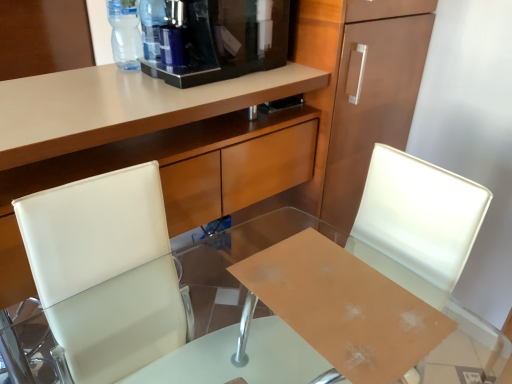
This screenshot has width=512, height=384. Describe the element at coordinates (264, 131) in the screenshot. I see `matte wood cabinet at upper center` at that location.

The width and height of the screenshot is (512, 384). Find the location of `white leather swivel chair at center`. white leather swivel chair at center is located at coordinates pos(105,271).

Describe the element at coordinates (152, 26) in the screenshot. This screenshot has width=512, height=384. I see `transparent plastic bottle at upper center, positioned as the second bottle in left-to-right order` at that location.

Find the location of `matte wood cabinet at upper center`. matte wood cabinet at upper center is located at coordinates (264, 131).

Is point (387, 212) closer or farther from the camera than point (312, 9)?

Point (387, 212) is closer to the camera than point (312, 9).

Based on the photo, which object is closer to the camera taking this photo, white leather chair at center or matte wood cabinet at upper center?

white leather chair at center.

Can you tell me how much white leather chair at center and matte wood cabinet at upper center differ in facing direction?

They differ by 90 degrees in their facing directions.

Is white leather chair at center bigger than matte wood cabinet at upper center?

Actually, white leather chair at center might be smaller than matte wood cabinet at upper center.

Based on their sizes in the image, would you say matte wood cabinet at upper center is bigger or smaller than transparent plastic bottle at upper center, marked as the second bottle in a right-to-left arrangement?

matte wood cabinet at upper center is bigger than transparent plastic bottle at upper center, marked as the second bottle in a right-to-left arrangement.

Is matte wood cabinet at upper center not within transparent plastic bottle at upper center, the first bottle viewed from the left?

Absolutely, matte wood cabinet at upper center is external to transparent plastic bottle at upper center, the first bottle viewed from the left.

Would you consider matte wood cabinet at upper center to be distant from transparent plastic bottle at upper center, marked as the second bottle in a right-to-left arrangement?

No, matte wood cabinet at upper center is in close proximity to transparent plastic bottle at upper center, marked as the second bottle in a right-to-left arrangement.

Which object is positioned more to the left, matte wood cabinet at upper center or transparent plastic bottle at upper center, marked as the second bottle in a right-to-left arrangement?

Positioned to the left is transparent plastic bottle at upper center, marked as the second bottle in a right-to-left arrangement.

Is the position of transparent plastic bottle at upper center, the first bottle viewed from the left, less distant than that of transparent plastic bottle at upper center, placed as the 1th bottle when sorted from right to left?

Yes, it is.

Looking at this image, is transparent plastic bottle at upper center, the first bottle viewed from the left, positioned with its back to transparent plastic bottle at upper center, placed as the 1th bottle when sorted from right to left?

Yes, transparent plastic bottle at upper center, the first bottle viewed from the left, is positioned with its back facing transparent plastic bottle at upper center, placed as the 1th bottle when sorted from right to left.

From a real-world perspective, is transparent plastic bottle at upper center, marked as the second bottle in a right-to-left arrangement, on transparent plastic bottle at upper center, positioned as the second bottle in left-to-right order?

No, from a real-world perspective, transparent plastic bottle at upper center, marked as the second bottle in a right-to-left arrangement, is not above transparent plastic bottle at upper center, positioned as the second bottle in left-to-right order.

What's the angular difference between transparent plastic bottle at upper center, the first bottle viewed from the left, and transparent plastic bottle at upper center, positioned as the second bottle in left-to-right order,'s facing directions?

transparent plastic bottle at upper center, the first bottle viewed from the left, and transparent plastic bottle at upper center, positioned as the second bottle in left-to-right order, are facing 4.75e-06 degrees away from each other.

Is matte wood cabinet at upper center looking in the opposite direction of black glossy coffee machine at upper center?

matte wood cabinet at upper center does not have its back to black glossy coffee machine at upper center.

Based on the photo, can you confirm if matte wood cabinet at upper center is thinner than black glossy coffee machine at upper center?

In fact, matte wood cabinet at upper center might be wider than black glossy coffee machine at upper center.

What's the angular difference between matte wood cabinet at upper center and black glossy coffee machine at upper center's facing directions?

The angle between the facing direction of matte wood cabinet at upper center and the facing direction of black glossy coffee machine at upper center is 88.2 degrees.

Which object is closer to the camera taking this photo, transparent glass desk at center or transparent plastic bottle at upper center, placed as the 1th bottle when sorted from right to left?

transparent glass desk at center is in front.

Are transparent glass desk at center and transparent plastic bottle at upper center, placed as the 1th bottle when sorted from right to left, beside each other?

transparent glass desk at center and transparent plastic bottle at upper center, placed as the 1th bottle when sorted from right to left, are not in contact.

Between point (297, 211) and point (157, 26), which one is positioned in front?

Positioned in front is point (157, 26).

Locate an element on the screen. The width and height of the screenshot is (512, 384). the 1st bottle positioned above the white leather swivel chair at center (from a real-world perspective) is located at coordinates (125, 33).

What's the angular difference between white leather swivel chair at center and transparent plastic bottle at upper center, marked as the second bottle in a right-to-left arrangement,'s facing directions?

83.4 degrees separate the facing orientations of white leather swivel chair at center and transparent plastic bottle at upper center, marked as the second bottle in a right-to-left arrangement.

Which is nearer, (72, 323) or (108, 14)?

Point (72, 323) is closer to the camera than point (108, 14).

Does point (239, 30) appear closer or farther from the camera than point (403, 160)?

Point (239, 30) is positioned farther from the camera compared to point (403, 160).

Do you think black glossy coffee machine at upper center is within white leather chair at center, or outside of it?

black glossy coffee machine at upper center cannot be found inside white leather chair at center.

Is black glossy coffee machine at upper center not near white leather chair at center?

black glossy coffee machine at upper center is near white leather chair at center, not far away.

From a real-world perspective, is black glossy coffee machine at upper center beneath white leather chair at center?

No, from a real-world perspective, black glossy coffee machine at upper center is not below white leather chair at center.

Locate an element on the screen. The width and height of the screenshot is (512, 384). chair in front of the matte wood cabinet at upper center is located at coordinates (417, 223).

Find the location of a particular element. The height and width of the screenshot is (384, 512). bottle on the left side of matte wood cabinet at upper center is located at coordinates (125, 33).

Looking at the image, which one is located closer to transparent plastic bottle at upper center, marked as the second bottle in a right-to-left arrangement, white leather chair at center or transparent plastic bottle at upper center, positioned as the second bottle in left-to-right order?

transparent plastic bottle at upper center, positioned as the second bottle in left-to-right order.

From the image, which object appears to be farther from transparent glass desk at center, transparent plastic bottle at upper center, positioned as the second bottle in left-to-right order, or transparent plastic bottle at upper center, marked as the second bottle in a right-to-left arrangement?

Among the two, transparent plastic bottle at upper center, positioned as the second bottle in left-to-right order, is located further to transparent glass desk at center.

From the image, which object appears to be nearer to transparent plastic bottle at upper center, placed as the 1th bottle when sorted from right to left, transparent glass desk at center or white leather chair at center?

Based on the image, white leather chair at center appears to be nearer to transparent plastic bottle at upper center, placed as the 1th bottle when sorted from right to left.

Estimate the real-world distances between objects in this image. Which object is closer to white leather swivel chair at center, black glossy coffee machine at upper center or transparent glass desk at center?

The object closer to white leather swivel chair at center is black glossy coffee machine at upper center.

Based on their spatial positions, is black glossy coffee machine at upper center or white leather swivel chair at center closer to transparent plastic bottle at upper center, positioned as the second bottle in left-to-right order?

The object closer to transparent plastic bottle at upper center, positioned as the second bottle in left-to-right order, is black glossy coffee machine at upper center.

Based on their spatial positions, is transparent plastic bottle at upper center, marked as the second bottle in a right-to-left arrangement, or white leather chair at center further from black glossy coffee machine at upper center?

white leather chair at center is further to black glossy coffee machine at upper center.

Estimate the real-world distances between objects in this image. Which object is further from white leather swivel chair at center, transparent plastic bottle at upper center, the first bottle viewed from the left, or black glossy coffee machine at upper center?

transparent plastic bottle at upper center, the first bottle viewed from the left, is further to white leather swivel chair at center.

When comparing their distances from transparent glass desk at center, does transparent plastic bottle at upper center, marked as the second bottle in a right-to-left arrangement, or black glossy coffee machine at upper center seem closer?

black glossy coffee machine at upper center is closer to transparent glass desk at center.

Where is `chair between black glossy coffee machine at upper center and white leather swivel chair at center vertically`? chair between black glossy coffee machine at upper center and white leather swivel chair at center vertically is located at coordinates (417, 223).

Find the location of a particular element. cabinetry between transparent plastic bottle at upper center, positioned as the second bottle in left-to-right order, and white leather swivel chair at center in the up-down direction is located at coordinates (264, 131).

Where is `swivel chair between black glossy coffee machine at upper center and transparent glass desk at center in the vertical direction`? The image size is (512, 384). swivel chair between black glossy coffee machine at upper center and transparent glass desk at center in the vertical direction is located at coordinates 105,271.

You are a GUI agent. You are given a task and a screenshot of the screen. Output one action in this format:
    pyautogui.click(x=<x>, y=<y>)
    Task: Click on the coffee machine between transparent plastic bottle at upper center, positioned as the second bottle in left-to-right order, and white leather swivel chair at center in the up-down direction
    
    Given the screenshot: What is the action you would take?
    pos(227,41)